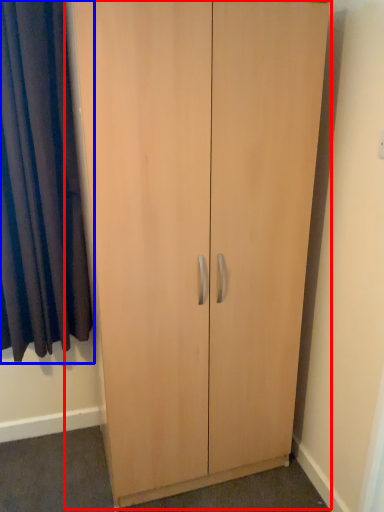
Question: Among these objects, which one is farthest to the camera, cupboard (highlighted by a red box) or curtain (highlighted by a blue box)?

Choices:
 (A) cupboard
 (B) curtain

Answer: (B)